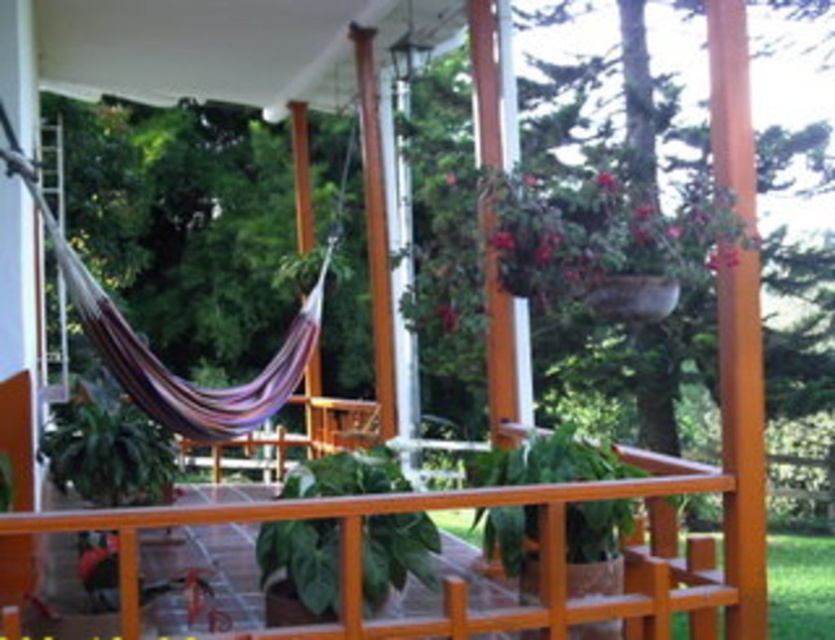
Locate an element on the screen. green matte plant at center is located at coordinates click(x=548, y=461).

Who is more distant from viewer, (468, 477) or (145, 444)?

The point (145, 444) is behind.

The width and height of the screenshot is (835, 640). What are the coordinates of `green matte plant at center` in the screenshot? It's located at (548, 461).

Can you confirm if green matte leafy plant at center is wider than green matte plant at center?

No.

In the scene shown: Who is positioned more to the right, green matte leafy plant at center or green matte plant at center?

green matte plant at center

Between point (302, 532) and point (498, 532), which one is positioned in front?

Point (302, 532) is in front.

Locate an element on the screen. This screenshot has height=640, width=835. green matte leafy plant at center is located at coordinates (x=302, y=561).

Does point (365, 480) come in front of point (99, 413)?

Yes.

Does green matte leafy plant at center have a lesser height compared to green leafy plant at center?

Yes.

The height and width of the screenshot is (640, 835). In order to click on green matte leafy plant at center in this screenshot , I will do `click(302, 561)`.

This screenshot has width=835, height=640. I want to click on green matte leafy plant at center, so click(x=302, y=561).